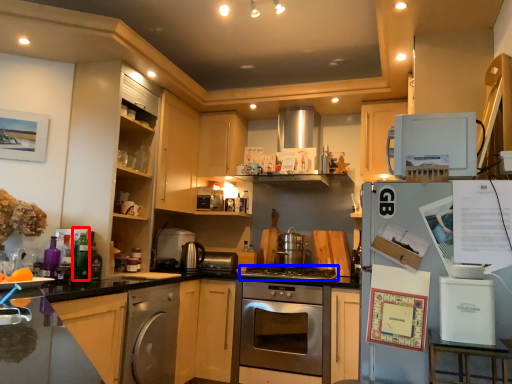
Question: Which of the following is the closest to the observer, bottle (highlighted by a red box) or gas stove (highlighted by a blue box)?

Choices:
 (A) bottle
 (B) gas stove

Answer: (A)